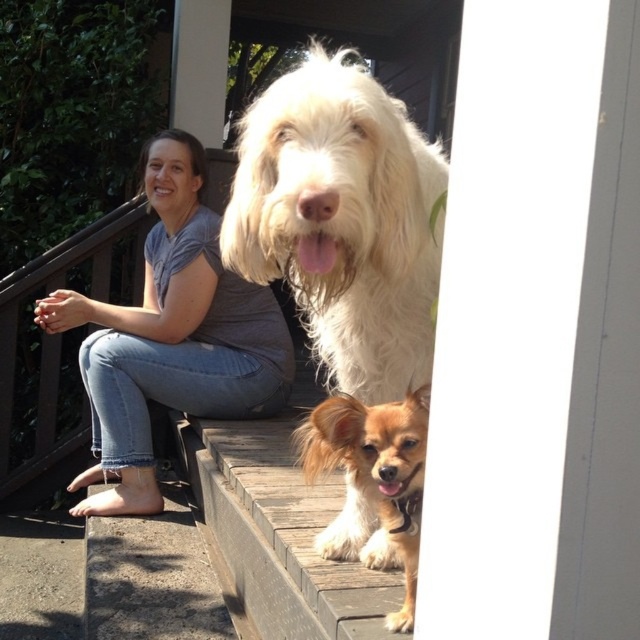
Which of these two, gray cotton shirt at upper left or golden fur dog at center, stands taller?

gray cotton shirt at upper left

Identify the location of gray cotton shirt at upper left. The image size is (640, 640). (170, 337).

You are a GUI agent. You are given a task and a screenshot of the screen. Output one action in this format:
    pyautogui.click(x=<x>, y=<y>)
    Task: Click on the gray cotton shirt at upper left
    The width and height of the screenshot is (640, 640).
    Given the screenshot: What is the action you would take?
    pyautogui.click(x=170, y=337)

Who is more distant from viewer, (332, 307) or (365, 449)?

The point (332, 307) is behind.

Which is more to the right, white fluffy dog at center or golden fur dog at center?

From the viewer's perspective, golden fur dog at center appears more on the right side.

Is point (337, 344) closer to camera compared to point (412, 401)?

No, (337, 344) is further to viewer.

This screenshot has width=640, height=640. What are the coordinates of `white fluffy dog at center` in the screenshot? It's located at (340, 220).

Is white fluffy dog at center positioned behind gray cotton shirt at upper left?

No, it is in front of gray cotton shirt at upper left.

Image resolution: width=640 pixels, height=640 pixels. Identify the location of white fluffy dog at center. (340, 220).